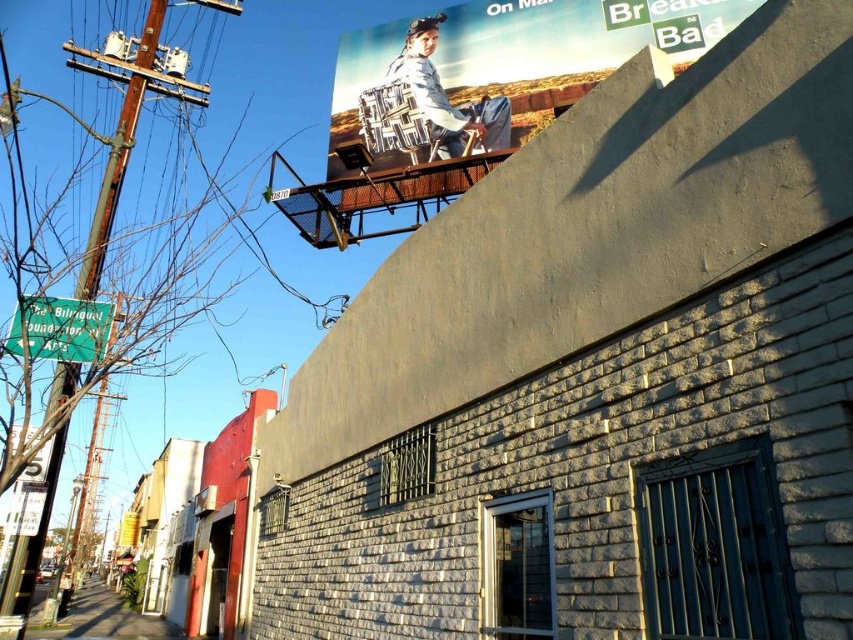
Can you confirm if matte plastic billboard at upper center is smaller than green plastic street sign at left?

Incorrect, matte plastic billboard at upper center is not smaller in size than green plastic street sign at left.

How distant is matte plastic billboard at upper center from green plastic street sign at left?

matte plastic billboard at upper center is 3.98 meters away from green plastic street sign at left.

What are the coordinates of `matte plastic billboard at upper center` in the screenshot? It's located at (498, 68).

Is matte plastic billboard at upper center below matte white shirt at upper center?

No, matte plastic billboard at upper center is not below matte white shirt at upper center.

Is point (370, 108) behind point (460, 120)?

Yes, it is behind point (460, 120).

At what (x,y) coordinates should I click in order to perform the action: click on matte plastic billboard at upper center. Please return your answer as a coordinate pair (x, y). Image resolution: width=853 pixels, height=640 pixels. Looking at the image, I should click on (498, 68).

Identify the location of matte plastic billboard at upper center. This screenshot has width=853, height=640. (498, 68).

Is matte white shirt at upper center behind green plastic street sign at left?

Yes.

You are a GUI agent. You are given a task and a screenshot of the screen. Output one action in this format:
    pyautogui.click(x=<x>, y=<y>)
    Task: Click on the matte white shirt at upper center
    
    Given the screenshot: What is the action you would take?
    pyautogui.click(x=445, y=97)